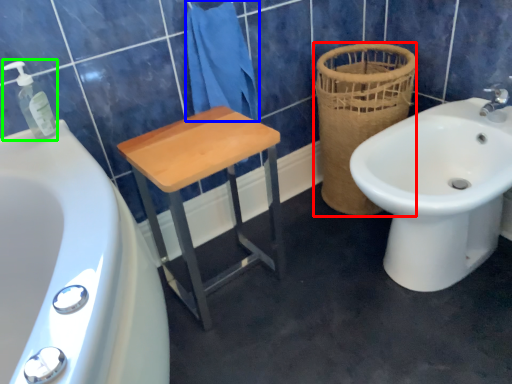
Question: Which is nearer to the basket (highlighted by a red box)? bath towel (highlighted by a blue box) or soap dispenser (highlighted by a green box).

Choices:
 (A) bath towel
 (B) soap dispenser

Answer: (A)